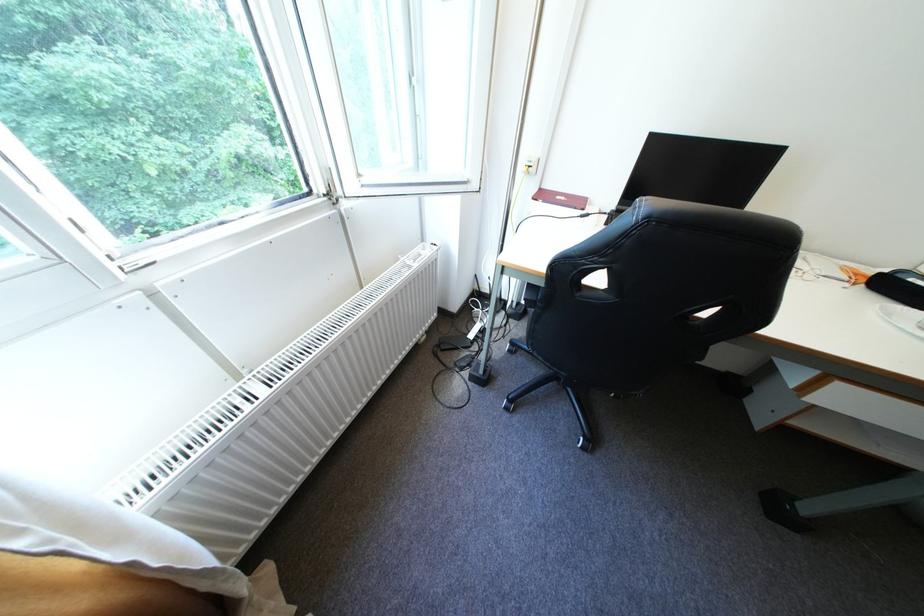
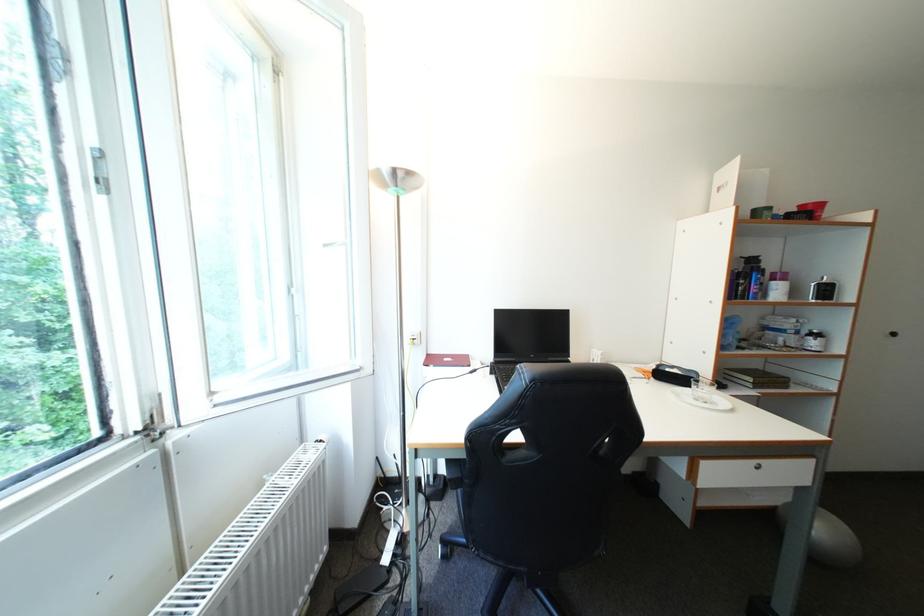
The images are taken continuously from a first-person perspective. In which direction is your viewpoint rotating?

The camera rotated toward right-up.